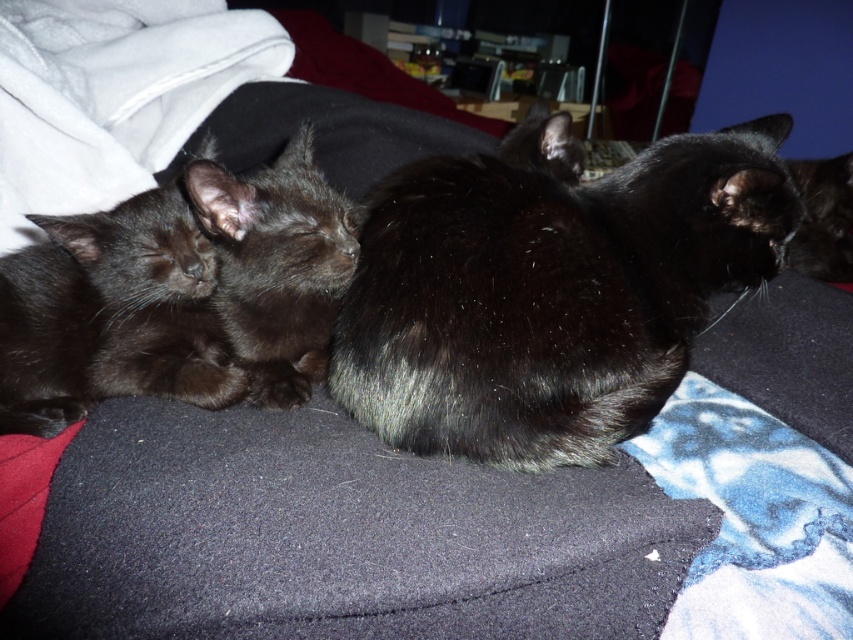
Question: Which of these objects is positioned farthest from the matte black kitten at left?

Choices:
 (A) shiny black kitten at center
 (B) shiny black cat at center

Answer: (B)

Question: Observing the image, what is the correct spatial positioning of matte black kitten at left in reference to shiny black kitten at center?

Choices:
 (A) below
 (B) above

Answer: (A)

Question: Estimate the real-world distances between objects in this image. Which object is closer to the shiny black cat at center?

Choices:
 (A) matte black kitten at left
 (B) shiny black kitten at center

Answer: (B)

Question: Does shiny black cat at center have a smaller size compared to shiny black kitten at center?

Choices:
 (A) no
 (B) yes

Answer: (A)

Question: Can you confirm if matte black kitten at left is positioned below shiny black kitten at center?

Choices:
 (A) yes
 (B) no

Answer: (A)

Question: Which object appears closest to the camera in this image?

Choices:
 (A) shiny black cat at center
 (B) shiny black kitten at center

Answer: (A)